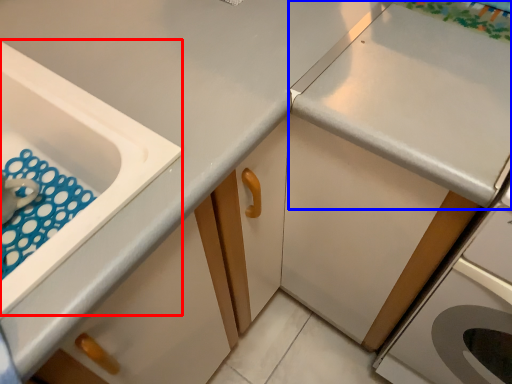
Question: Which point is closer to the camera, sink (highlighted by a red box) or countertop (highlighted by a blue box)?

Choices:
 (A) sink
 (B) countertop

Answer: (A)